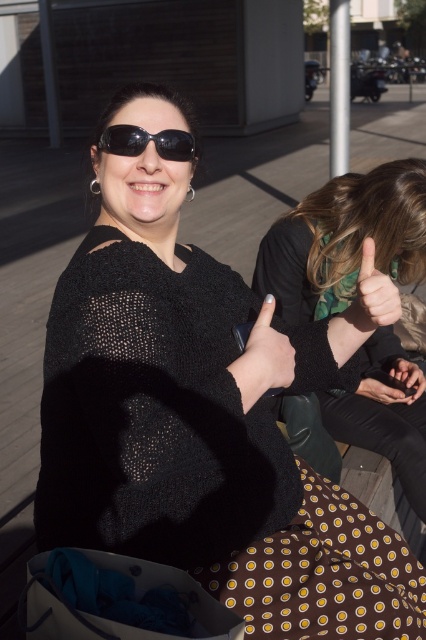
In the scene, you see a woman wearing a black knit sweater at upper right and a smooth skin hand at lower right. From the perspective of someone looking at the image, which object is positioned to the left?

The black knit sweater at upper right is positioned to the left of the smooth skin hand at lower right.

What is located at the coordinates point [264,358]?

A matte black hand is located at point [264,358].

You are a photographer adjusting the camera settings. You want to ensure both the black knit sweater at upper right and the smooth skin hand at lower right are in focus. Given that the depth of field can cover 12 inches, will both objects be in focus?

The black knit sweater at upper right and smooth skin hand at lower right are 11.68 inches apart from each other. Since the depth of field can cover 12 inches, both objects will be in focus.